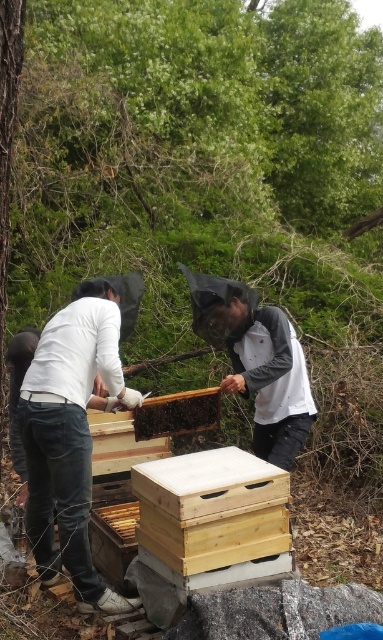
Question: Estimate the real-world distances between objects in this image. Which object is closer to the white fabric beekeeper suit at center?

Choices:
 (A) light wood beehive at center
 (B) wooden beehive at center
 (C) white matte shirt at center

Answer: (B)

Question: Based on their relative distances, which object is farther from the white matte shirt at center?

Choices:
 (A) light wood beehive at center
 (B) white fabric beekeeper suit at center
 (C) wooden beehive at center

Answer: (B)

Question: Is white matte shirt at center to the left of wooden beehive at center from the viewer's perspective?

Choices:
 (A) yes
 (B) no

Answer: (A)

Question: Which point is farther from the camera taking this photo?

Choices:
 (A) (168, 422)
 (B) (83, 433)
 (C) (186, 500)

Answer: (A)

Question: Is white matte shirt at center behind wooden beehive at center?

Choices:
 (A) yes
 (B) no

Answer: (B)

Question: Can you confirm if white matte shirt at center is wider than light wood beehive at center?

Choices:
 (A) no
 (B) yes

Answer: (A)